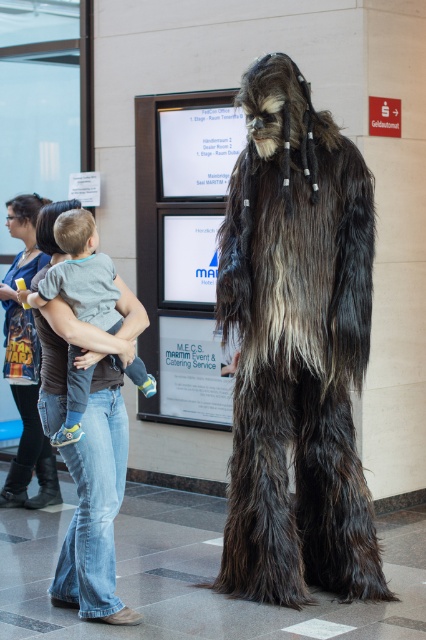
Does fuzzy brown costume at center have a lesser width compared to gray cotton shirt at center?

In fact, fuzzy brown costume at center might be wider than gray cotton shirt at center.

Can you confirm if fuzzy brown costume at center is positioned to the left of gray cotton shirt at center?

No, fuzzy brown costume at center is not to the left of gray cotton shirt at center.

Is point (365, 321) positioned behind point (74, 298)?

Yes.

Where is `fuzzy brown costume at center`? The image size is (426, 640). fuzzy brown costume at center is located at coordinates (296, 348).